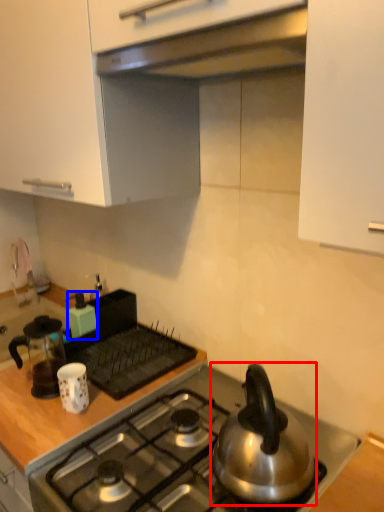
Question: Which object appears farthest to the camera in this image, kettle (highlighted by a red box) or kitchen appliance (highlighted by a blue box)?

Choices:
 (A) kettle
 (B) kitchen appliance

Answer: (B)